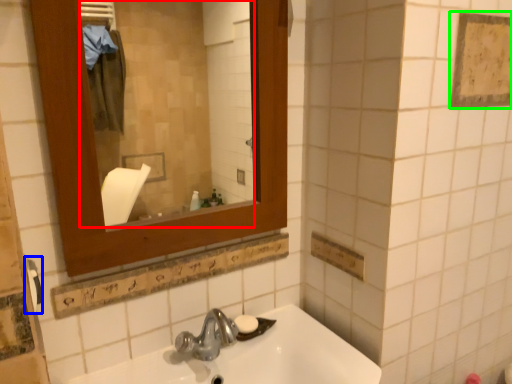
Question: Estimate the real-world distances between objects in this image. Which object is closer to mirror (highlighted by a red box), towel bar (highlighted by a blue box) or square (highlighted by a green box)?

Choices:
 (A) towel bar
 (B) square

Answer: (B)